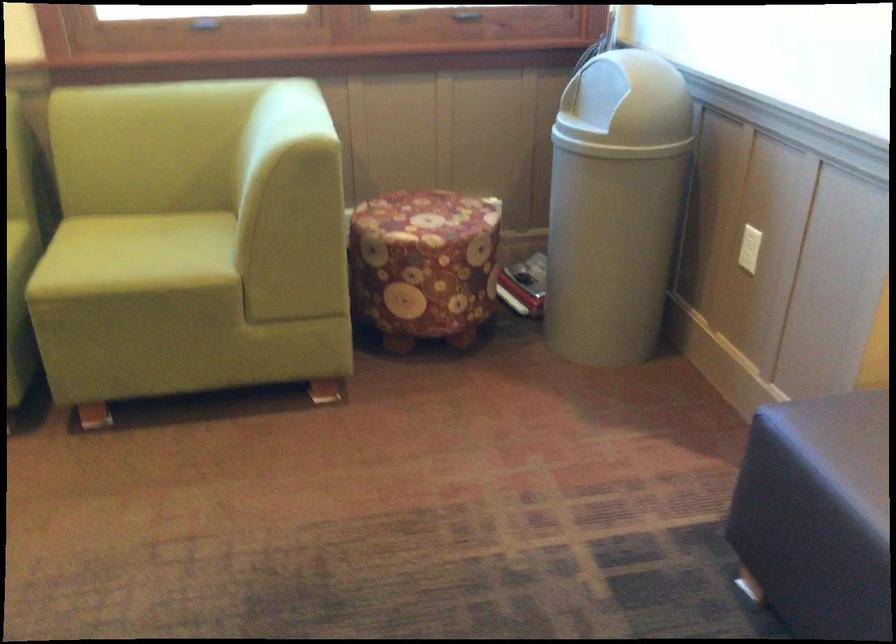
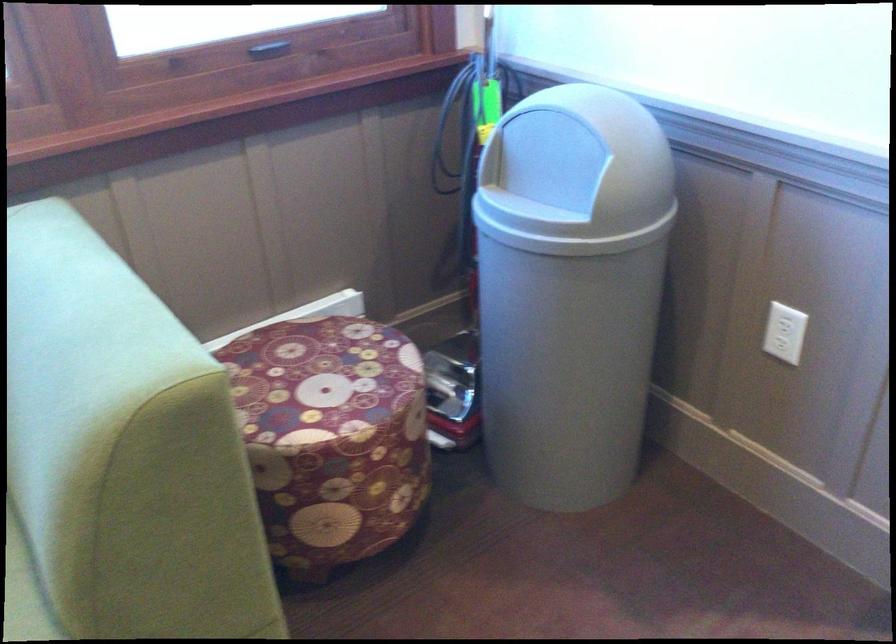
The point at (429, 214) is marked in the first image. Where is the corresponding point in the second image?

(320, 373)